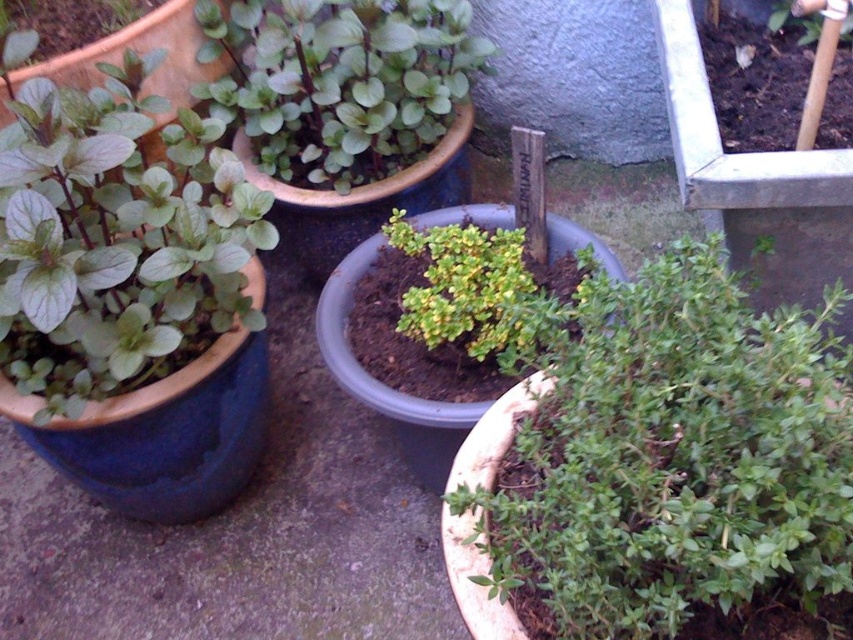
Question: Is green matte leaves at left further to the viewer compared to green matte pot at upper left?

Choices:
 (A) yes
 (B) no

Answer: (B)

Question: Which point is closer to the camera?

Choices:
 (A) green matte pot at upper left
 (B) green matte plant at center

Answer: (B)

Question: Is green matte plant at center further to the viewer compared to green matte pot at upper left?

Choices:
 (A) yes
 (B) no

Answer: (B)

Question: Is green matte plant at center to the left of green matte leaves at left from the viewer's perspective?

Choices:
 (A) no
 (B) yes

Answer: (A)

Question: Which point is farther from the camera taking this photo?

Choices:
 (A) (326, 28)
 (B) (54, 128)
 (C) (585, 524)

Answer: (A)

Question: Which of the following is the farthest from the observer?

Choices:
 (A) (347, 108)
 (B) (183, 248)

Answer: (A)